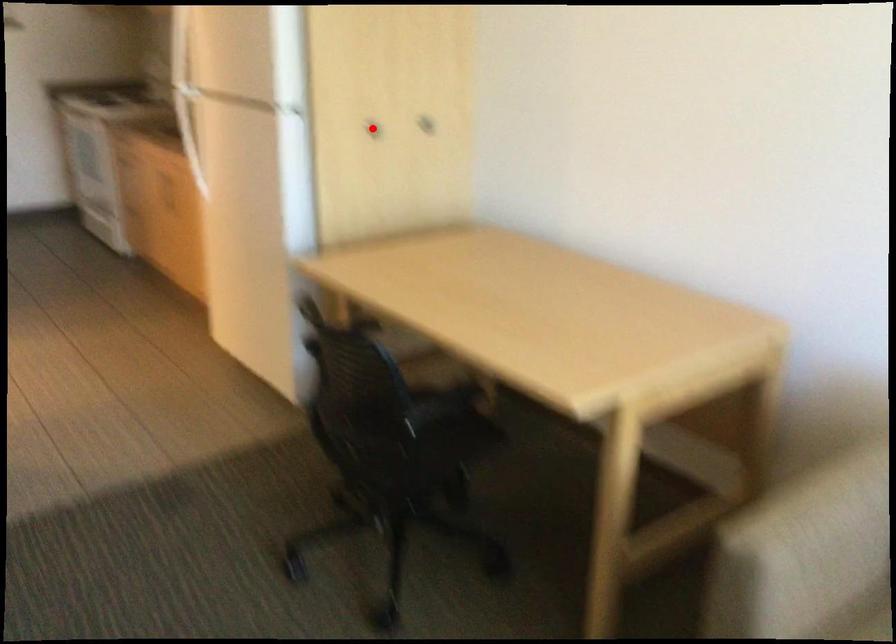
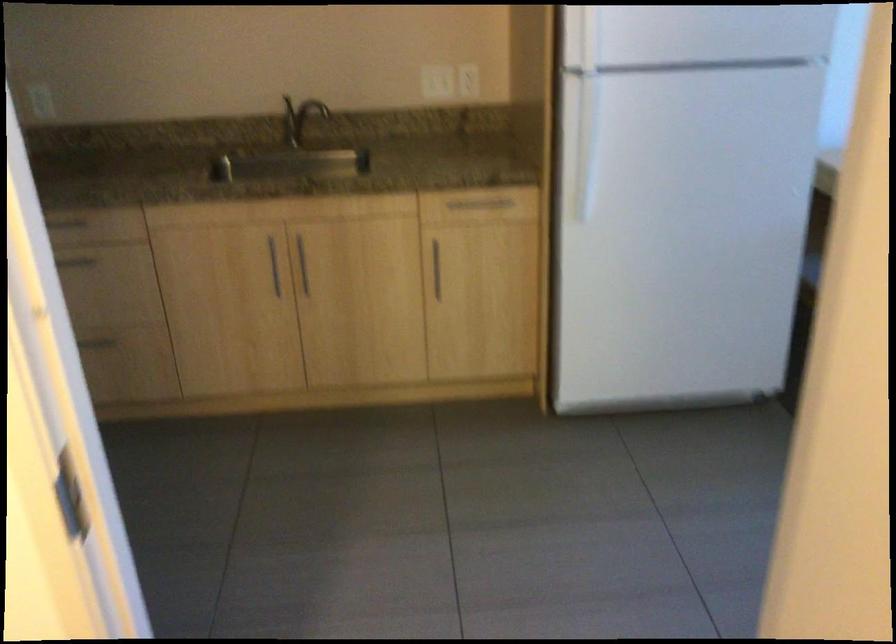
Question: I am providing you with two images of the same scene from different viewpoints. A red point is marked on the first image. Can you still see the location of the red point in image 2?

Choices:
 (A) Yes
 (B) No

Answer: (B)